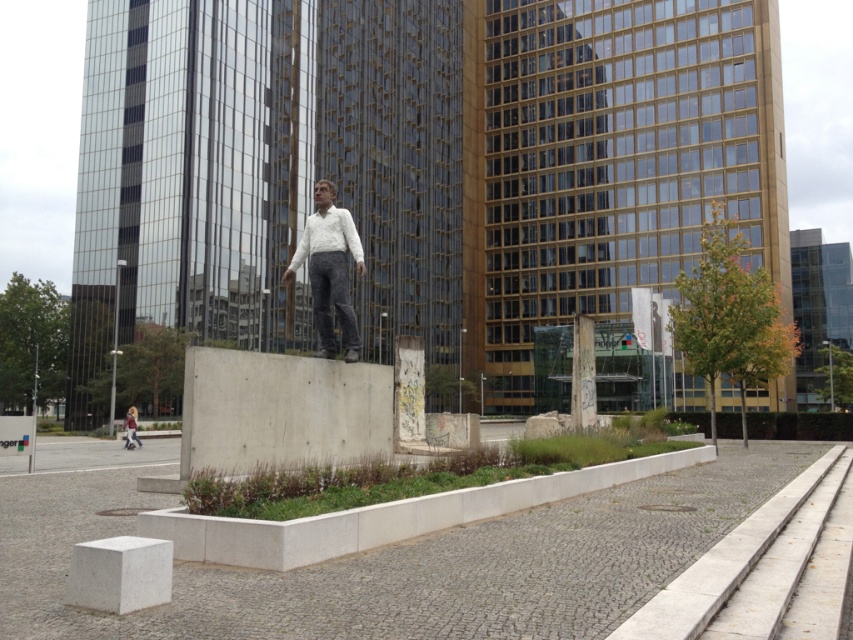
Question: Based on their relative distances, which object is nearer to the concrete at center?

Choices:
 (A) light brown leather jacket at lower left
 (B) white matte statue at center
 (C) white concrete block at lower left
 (D) concreteroughsculpture at center

Answer: (C)

Question: Can you confirm if concreteroughsculpture at center is bigger than white matte statue at center?

Choices:
 (A) yes
 (B) no

Answer: (A)

Question: Which is farther from the light brown leather jacket at lower left?

Choices:
 (A) concreteroughsculpture at center
 (B) concrete at center

Answer: (B)

Question: Does concreteroughsculpture at center appear under concrete at center?

Choices:
 (A) yes
 (B) no

Answer: (B)

Question: Which point is farther to the camera?

Choices:
 (A) concreteroughsculpture at center
 (B) white matte statue at center
 (C) concrete at center

Answer: (B)

Question: Is concreteroughsculpture at center bigger than white concrete block at lower left?

Choices:
 (A) no
 (B) yes

Answer: (B)